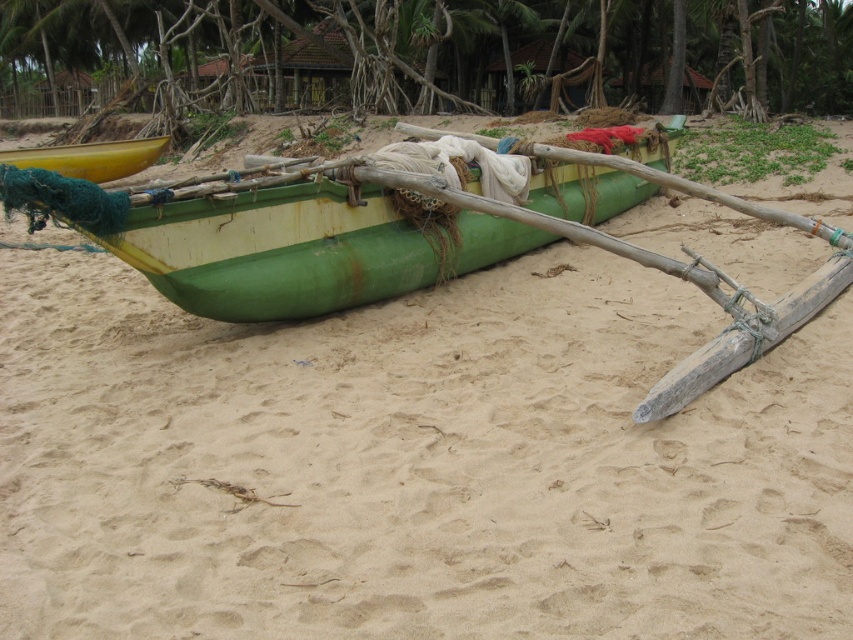
Does green matte boat at center come behind yellow matte canoe at left?

No, it is not.

Which of these two, green matte boat at center or yellow matte canoe at left, stands taller?

green matte boat at center is taller.

Image resolution: width=853 pixels, height=640 pixels. Describe the element at coordinates (274, 237) in the screenshot. I see `green matte boat at center` at that location.

You are a GUI agent. You are given a task and a screenshot of the screen. Output one action in this format:
    pyautogui.click(x=<x>, y=<y>)
    Task: Click on the green matte boat at center
    
    Given the screenshot: What is the action you would take?
    pyautogui.click(x=274, y=237)